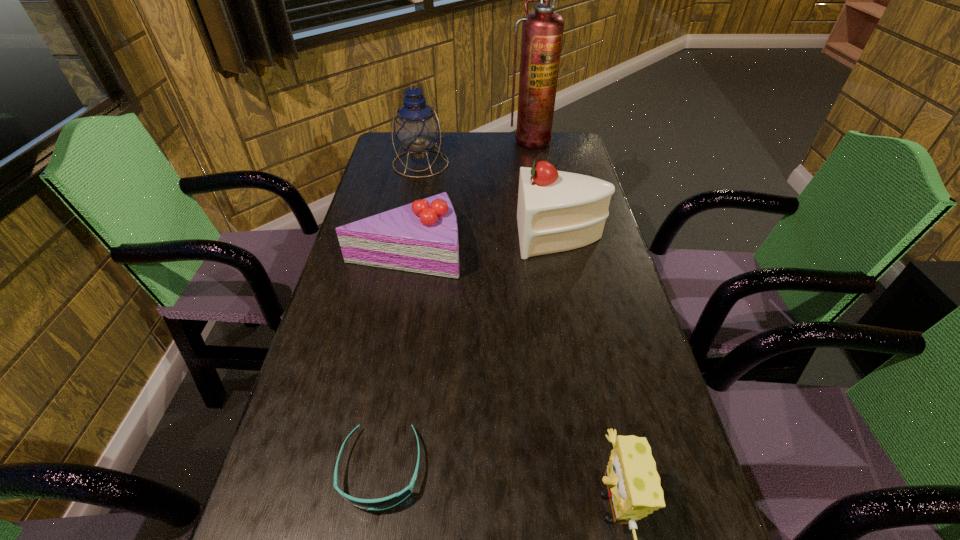
Locate an element on the screen. fire extinguisher that is at the far edge is located at coordinates (542, 31).

This screenshot has height=540, width=960. In order to click on lantern that is positioned at the far edge in this screenshot , I will do `click(417, 128)`.

Where is `lantern located in the left edge section of the desktop`? lantern located in the left edge section of the desktop is located at coordinates (417, 128).

Locate an element on the screen. The width and height of the screenshot is (960, 540). cake that is at the left edge is located at coordinates (422, 237).

Find the location of a particular element. sunglasses that is at the left edge is located at coordinates point(387,502).

Find the location of a particular element. fire extinguisher that is at the right edge is located at coordinates (542, 31).

Find the location of `cake that is at the right edge`. cake that is at the right edge is located at coordinates (557, 211).

Where is `object at the far left corner`? The width and height of the screenshot is (960, 540). object at the far left corner is located at coordinates (417, 128).

The height and width of the screenshot is (540, 960). Find the location of `object positioned at the far right corner`. object positioned at the far right corner is located at coordinates (542, 31).

This screenshot has height=540, width=960. What are the coordinates of `vacant space at the far edge of the desktop` in the screenshot? It's located at (455, 147).